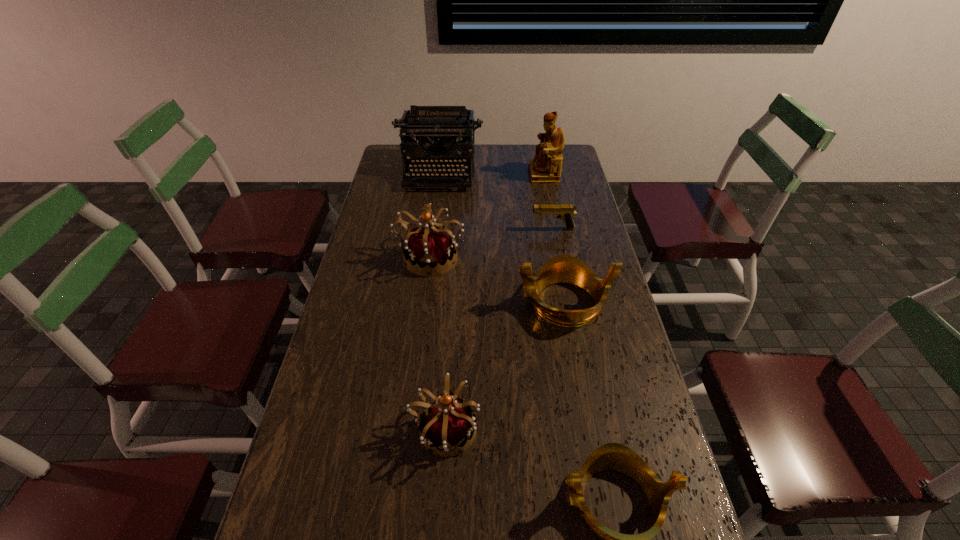
The image size is (960, 540). Find the location of `figurine`. figurine is located at coordinates (546, 166).

The height and width of the screenshot is (540, 960). Find the location of `typewriter`. typewriter is located at coordinates (426, 124).

Find the location of a particular element. the farther red tiara is located at coordinates point(432,249).

Locate an element on the screen. the bigger red tiara is located at coordinates [x=432, y=249].

Where is `the smaller red tiara`? The image size is (960, 540). the smaller red tiara is located at coordinates (447, 424).

You are a GUI agent. You are given a task and a screenshot of the screen. Output one action in this format:
    pyautogui.click(x=<x>, y=<y>)
    Task: Click on the bigger gold tiara
    
    Given the screenshot: What is the action you would take?
    pyautogui.click(x=563, y=268)

This screenshot has height=540, width=960. What are the coordinates of `the third farthest object` in the screenshot? It's located at (565, 212).

The height and width of the screenshot is (540, 960). What are the coordinates of `the shortest object` in the screenshot? It's located at (565, 212).

The image size is (960, 540). I want to click on vacant space located on the front-facing side of the figurine, so click(449, 174).

Find the location of a particular element. The height and width of the screenshot is (540, 960). free space located on the front-facing side of the figurine is located at coordinates (459, 174).